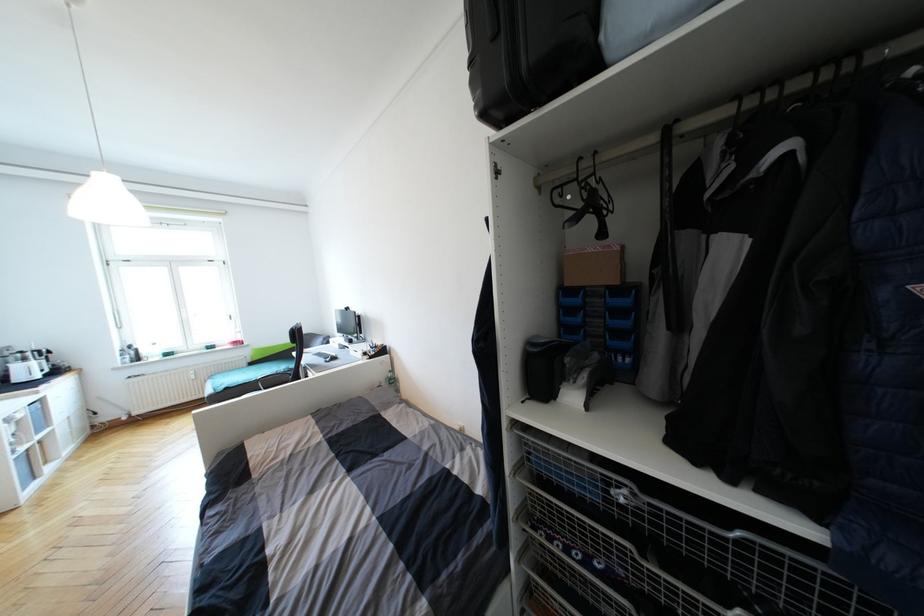
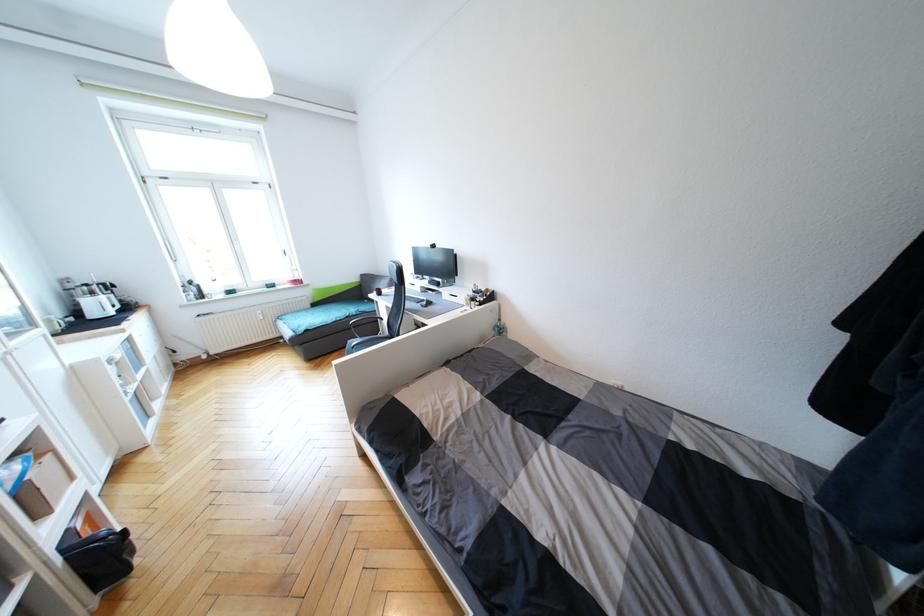
The point at (28, 361) is marked in the first image. Where is the corresponding point in the second image?

(95, 294)